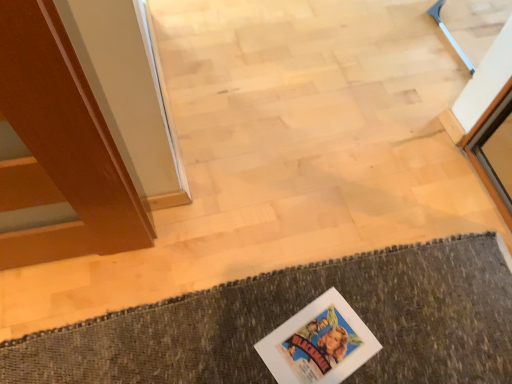
This screenshot has width=512, height=384. I want to click on free spot behind colorful paper comic book at lower center, so click(x=327, y=282).